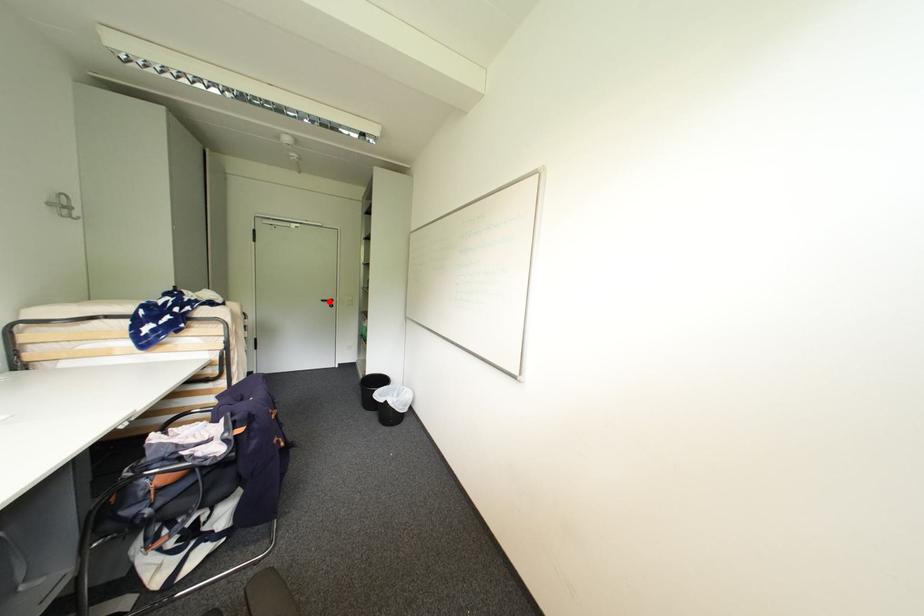
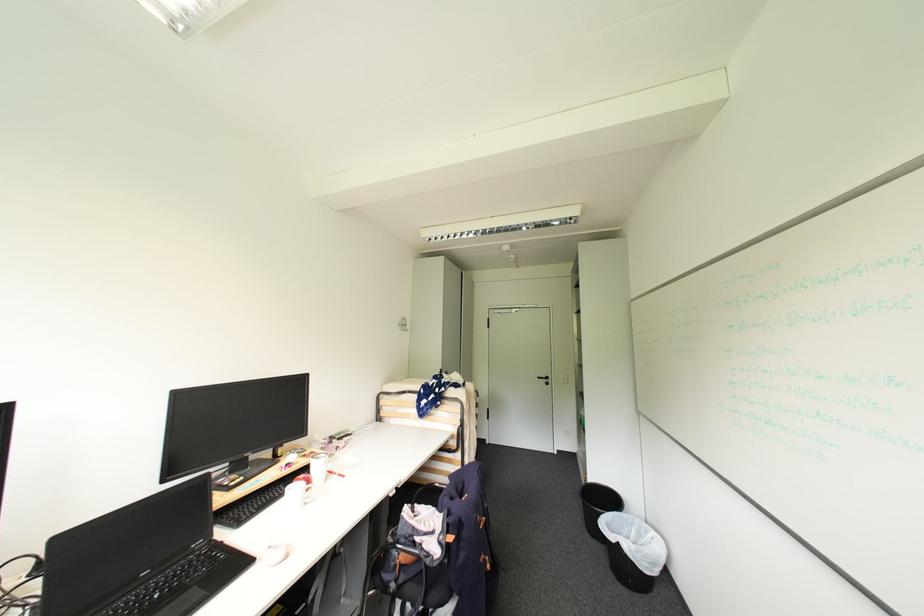
Locate, in the second image, the point that corresponds to the highlighted location in the first image.

(544, 379)